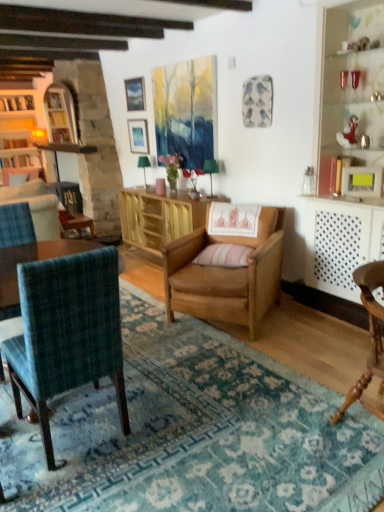
Question: Can you confirm if wooden chair at lower right, marked as the third chair in a left-to-right arrangement, is bigger than matte silver picture frame at upper center, which is counted as the second picture frame, starting from the left?

Choices:
 (A) no
 (B) yes

Answer: (B)

Question: Is wooden chair at lower right, which is counted as the first chair, starting from the right, facing away from matte silver picture frame at upper center, which is counted as the second picture frame, starting from the left?

Choices:
 (A) no
 (B) yes

Answer: (B)

Question: Considering the relative positions of wooden chair at lower right, which is counted as the first chair, starting from the right, and matte silver picture frame at upper center, the first picture frame from the back, in the image provided, is wooden chair at lower right, which is counted as the first chair, starting from the right, to the left of matte silver picture frame at upper center, the first picture frame from the back, from the viewer's perspective?

Choices:
 (A) no
 (B) yes

Answer: (A)

Question: Is the position of wooden chair at lower right, which is counted as the first chair, starting from the right, more distant than that of matte silver picture frame at upper center, the first picture frame from the back?

Choices:
 (A) yes
 (B) no

Answer: (B)

Question: Is wooden chair at lower right, marked as the third chair in a left-to-right arrangement, far from matte silver picture frame at upper center, arranged as the 2th picture frame when viewed from the top?

Choices:
 (A) no
 (B) yes

Answer: (B)

Question: In terms of height, does white polka dot radiator at right look taller or shorter compared to matte wooden picture frame at upper center, the second picture frame viewed from the back?

Choices:
 (A) short
 (B) tall

Answer: (B)

Question: Is white polka dot radiator at right to the left or to the right of matte wooden picture frame at upper center, the second picture frame viewed from the back, in the image?

Choices:
 (A) right
 (B) left

Answer: (A)

Question: Is white polka dot radiator at right bigger or smaller than matte wooden picture frame at upper center, the 1th picture frame positioned from the top?

Choices:
 (A) big
 (B) small

Answer: (A)

Question: Does point (309, 253) appear closer or farther from the camera than point (130, 82)?

Choices:
 (A) farther
 (B) closer

Answer: (B)

Question: Relative to green fabric lampshade at upper center, which appears as the 2th lamp when viewed from the front, is matte silver picture frame at upper center, the first picture frame from the back, in front or behind?

Choices:
 (A) front
 (B) behind

Answer: (B)

Question: From the image's perspective, is matte silver picture frame at upper center, marked as the 2th picture frame in a right-to-left arrangement, above or below green fabric lampshade at upper center, which is counted as the first lamp, starting from the back?

Choices:
 (A) below
 (B) above

Answer: (B)

Question: From a real-world perspective, relative to green fabric lampshade at upper center, the second lamp positioned from the right, is matte silver picture frame at upper center, the third picture frame when ordered from front to back, vertically above or below?

Choices:
 (A) below
 (B) above

Answer: (B)

Question: Is point (130, 147) closer or farther from the camera than point (144, 170)?

Choices:
 (A) closer
 (B) farther

Answer: (B)

Question: Visually, is wooden bookshelf at left positioned to the left or to the right of pink striped pillow at center?

Choices:
 (A) left
 (B) right

Answer: (A)

Question: From the image's perspective, is wooden bookshelf at left located above or below pink striped pillow at center?

Choices:
 (A) above
 (B) below

Answer: (A)